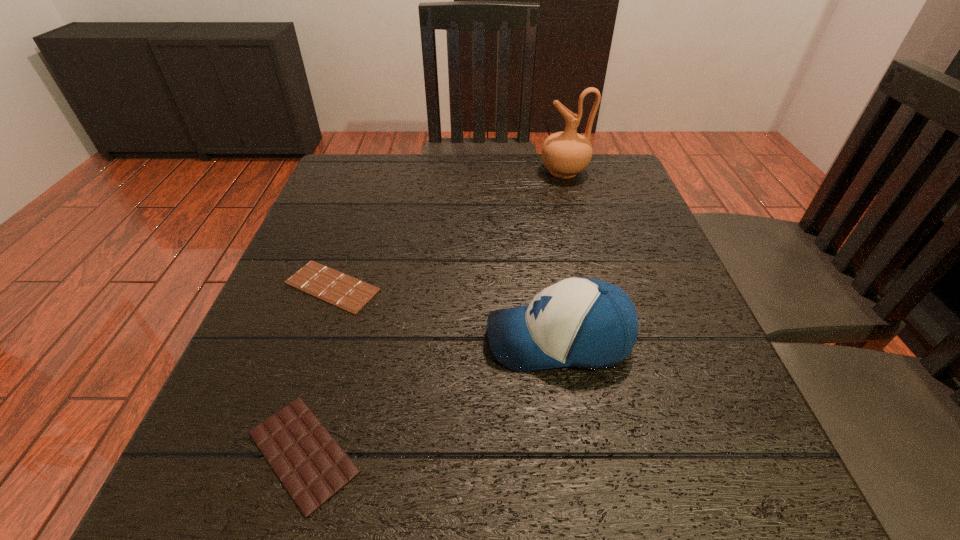
Locate an element on the screen. Image resolution: width=960 pixels, height=540 pixels. blank space at the near edge of the desktop is located at coordinates (545, 521).

In the image, there is a desktop. Where is `vacant space at the left edge`? Image resolution: width=960 pixels, height=540 pixels. vacant space at the left edge is located at coordinates (260, 371).

Locate an element on the screen. This screenshot has height=540, width=960. vacant space at the right edge of the desktop is located at coordinates (x=659, y=257).

At what (x,y) coordinates should I click in order to perform the action: click on free location at the far left corner. Please return your answer as a coordinate pair (x, y). Image resolution: width=960 pixels, height=540 pixels. Looking at the image, I should click on (371, 173).

Identify the location of free point at the far right corner. (595, 181).

Locate an element on the screen. empty space that is in between the farther chocolate bar and the tallest object is located at coordinates (448, 229).

The image size is (960, 540). I want to click on empty space that is in between the farther chocolate bar and the pottery, so click(448, 229).

Find the location of a particular element. The image size is (960, 540). vacant point located between the farthest object and the farther chocolate bar is located at coordinates (448, 229).

Where is `vacant region between the baseball cap and the tallest object`? vacant region between the baseball cap and the tallest object is located at coordinates (562, 255).

At what (x,y) coordinates should I click in order to perform the action: click on vacant area that lies between the third shortest object and the pottery. Please return your answer as a coordinate pair (x, y). This screenshot has width=960, height=540. Looking at the image, I should click on (562, 255).